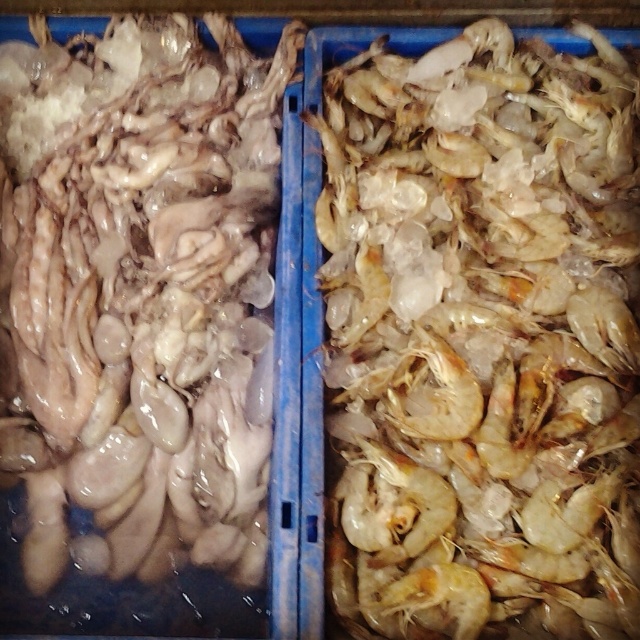
Question: Is translucent white shrimp at right smaller than translucent rubber squid at left?

Choices:
 (A) yes
 (B) no

Answer: (B)

Question: Does translucent white shrimp at right have a lesser width compared to translucent rubber squid at left?

Choices:
 (A) no
 (B) yes

Answer: (A)

Question: Among these points, which one is nearest to the camera?

Choices:
 (A) (624, 632)
 (B) (216, 481)

Answer: (A)

Question: From the image, what is the correct spatial relationship of translucent white shrimp at right in relation to translucent rubber squid at left?

Choices:
 (A) left
 (B) right

Answer: (B)